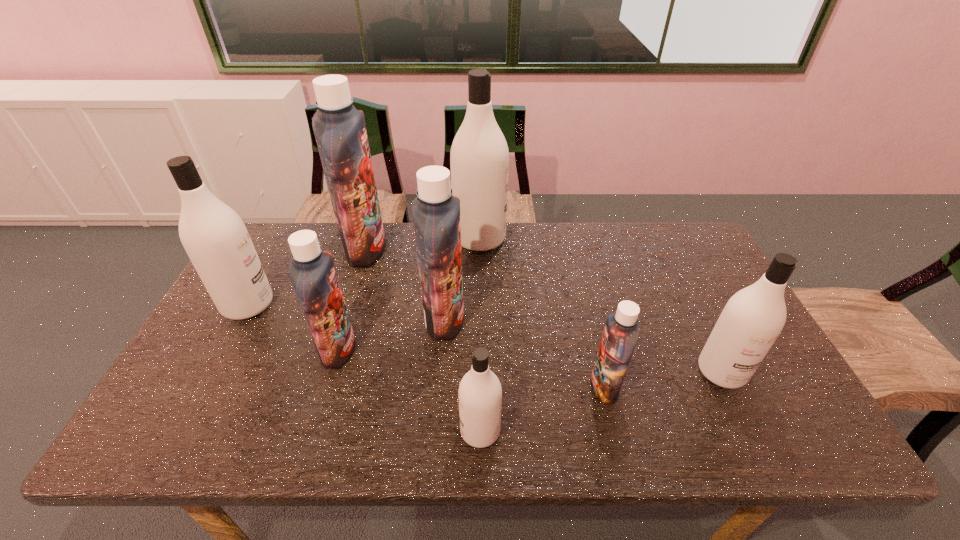
Locate an element on the screen. The image size is (960, 540). free space located on the front label of the rightmost blue shampoo is located at coordinates (540, 386).

This screenshot has width=960, height=540. I want to click on free location located 0.110m on the front-facing side of the nearest white shampoo, so click(x=410, y=431).

Find the location of `free space located 0.050m on the front-facing side of the nearest white shampoo`. free space located 0.050m on the front-facing side of the nearest white shampoo is located at coordinates (438, 431).

Locate an element on the screen. This screenshot has height=540, width=960. free region located 0.100m on the front-facing side of the nearest white shampoo is located at coordinates (415, 431).

Find the location of a particular element. The width and height of the screenshot is (960, 540). object located at the near edge is located at coordinates (480, 393).

Find the location of a particular element. The height and width of the screenshot is (540, 960). object that is at the left edge is located at coordinates (214, 236).

This screenshot has height=540, width=960. I want to click on object that is at the right edge, so click(753, 318).

In order to click on vacant region at the far edge of the desktop in this screenshot , I will do `click(556, 251)`.

Where is `vacant region at the near edge of the desktop`? The height and width of the screenshot is (540, 960). vacant region at the near edge of the desktop is located at coordinates (627, 415).

Identify the location of vacant space at the left edge of the desktop. This screenshot has height=540, width=960. (248, 342).